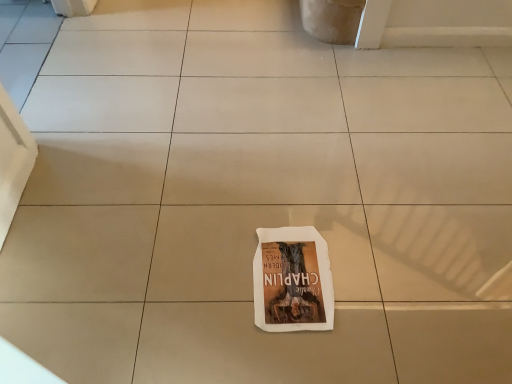
Where is `vacant position to the left of white paper magazine at center`? vacant position to the left of white paper magazine at center is located at coordinates (206, 273).